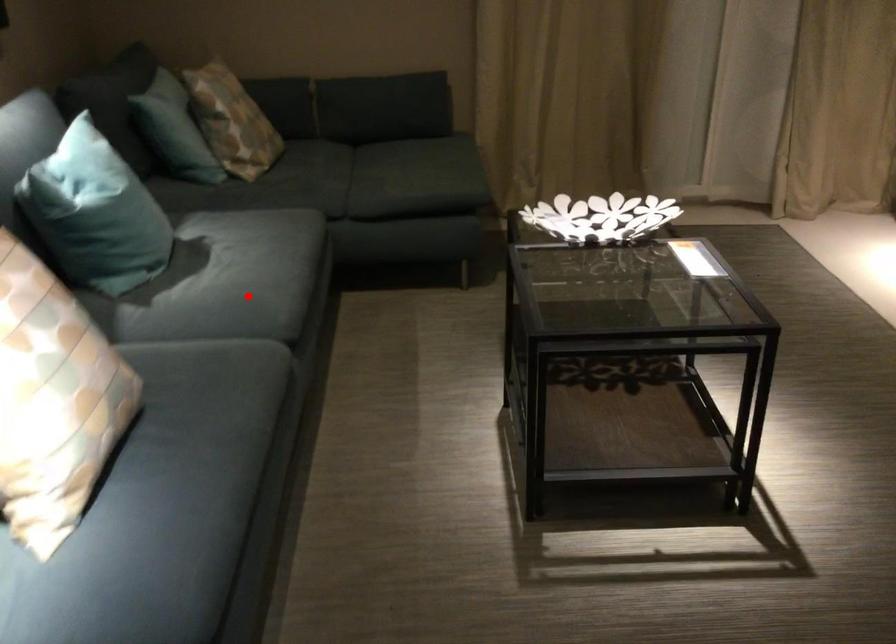
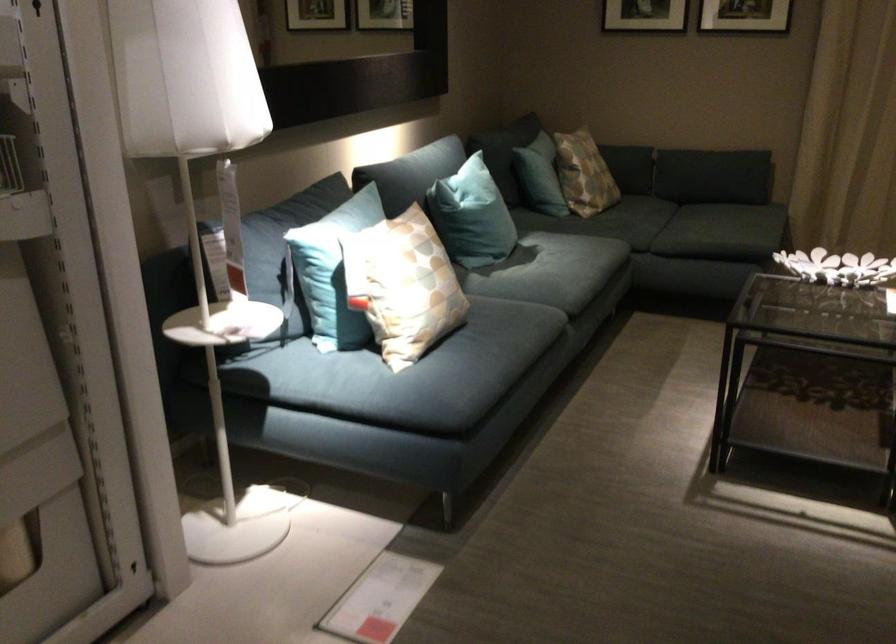
In the second image, find the point that corresponds to the highlighted location in the first image.

(552, 275)